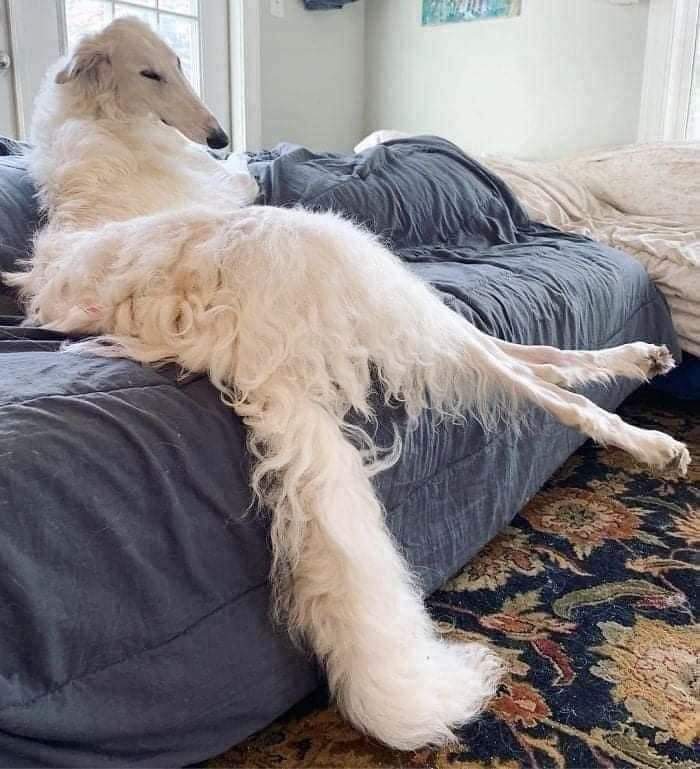
Where is `blanket`? blanket is located at coordinates (449, 197).